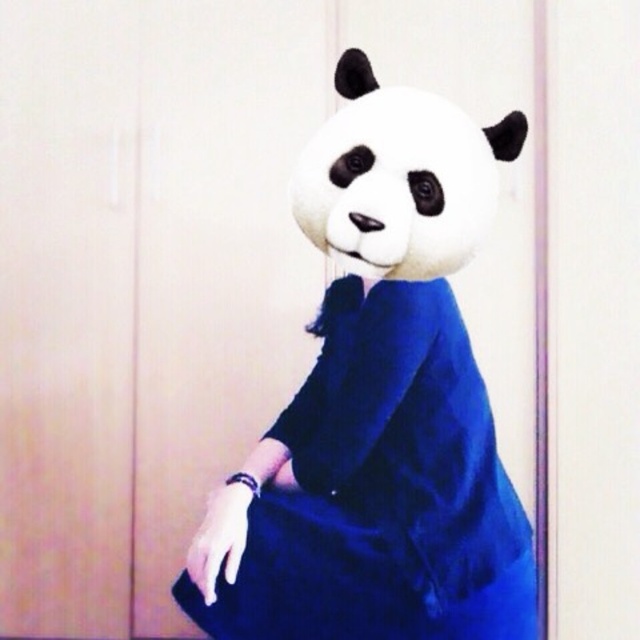
You are standing in front of a wooden door and see a person wearing a panda head mask and a blue dress. There is a point at coordinates (381, 490). What is located at that point?

The point at (381, 490) is where the velvet blue dress at center is located.

You are a photographer setting up a shoot in front of a light wooden door. You have a velvet blue dress at center and a white plush panda at center. Where should you position the camera to capture both objects in the frame without cropping either?

Position the camera so that the white plush panda at center is above the velvet blue dress at center, as the velvet blue dress at center is located below the white plush panda at center.

You are standing in front of the door and see two points marked on the image. Which point is closer to you, point (248, 572) or point (349, 104)?

Point (349, 104) is closer to you because point (248, 572) is behind it.